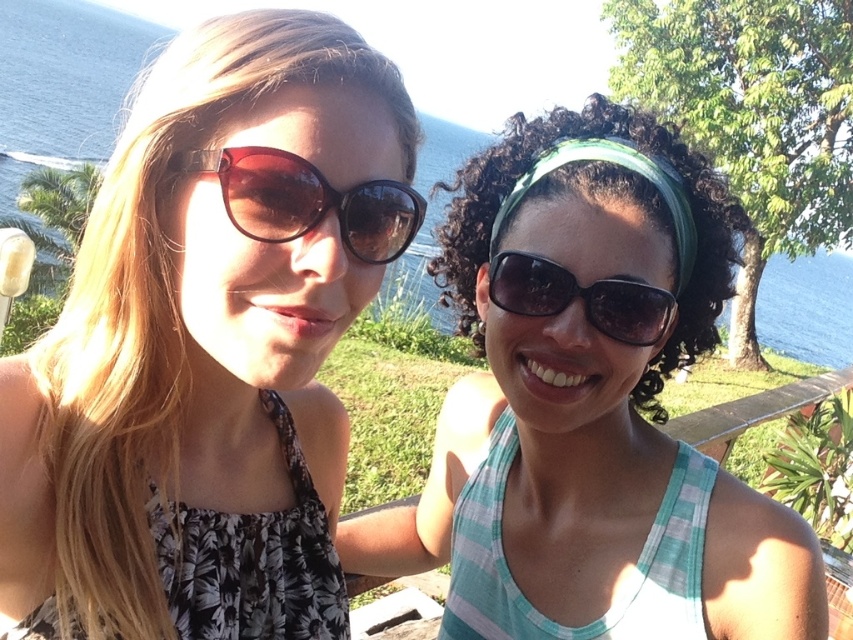
You are standing in the scene and want to move from the point at coordinates point (x=268, y=164) to the point at coordinates point (x=624, y=296). Which direction should you face to walk towards the second point?

Since point (x=268, y=164) is closer to the viewer than point (x=624, y=296), you should face away from the viewer to walk towards the second point.

You are a photographer trying to capture both the matte black sunglasses at left and the brown glossy sunglasses at left in a single frame. Since you want to ensure both are visible, which sunglasses should you focus on first to adjust the framing?

The matte black sunglasses at left is much taller than the brown glossy sunglasses at left, so you should focus on the matte black sunglasses at left first to adjust the framing, ensuring it fits within the frame before adjusting for the smaller one.